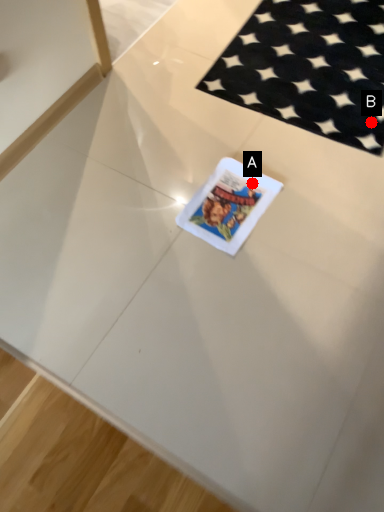
Question: Two points are circled on the image, labeled by A and B beside each circle. Which point is further to the camera?

Choices:
 (A) A is further
 (B) B is further

Answer: (B)